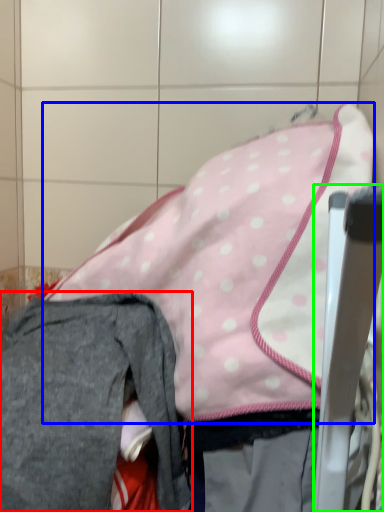
Question: Considering the real-world distances, which object is farthest from trousers (highlighted by a red box)? wide (highlighted by a blue box) or chair (highlighted by a green box)?

Choices:
 (A) wide
 (B) chair

Answer: (B)